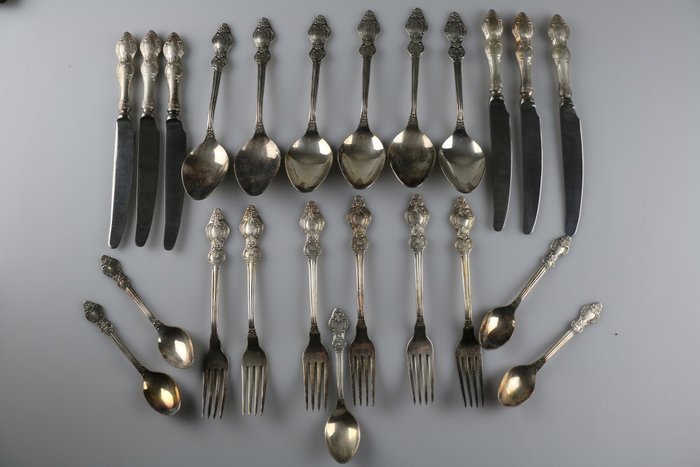
Find the location of a particular element. The width and height of the screenshot is (700, 467). butter knives is located at coordinates pyautogui.click(x=122, y=140), pyautogui.click(x=143, y=157), pyautogui.click(x=175, y=182), pyautogui.click(x=503, y=159), pyautogui.click(x=538, y=166), pyautogui.click(x=566, y=169).